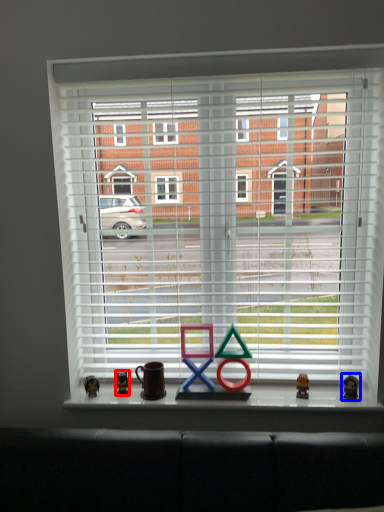
Question: Which object is further to the camera taking this photo, miniature (highlighted by a red box) or miniature (highlighted by a blue box)?

Choices:
 (A) miniature
 (B) miniature

Answer: (A)